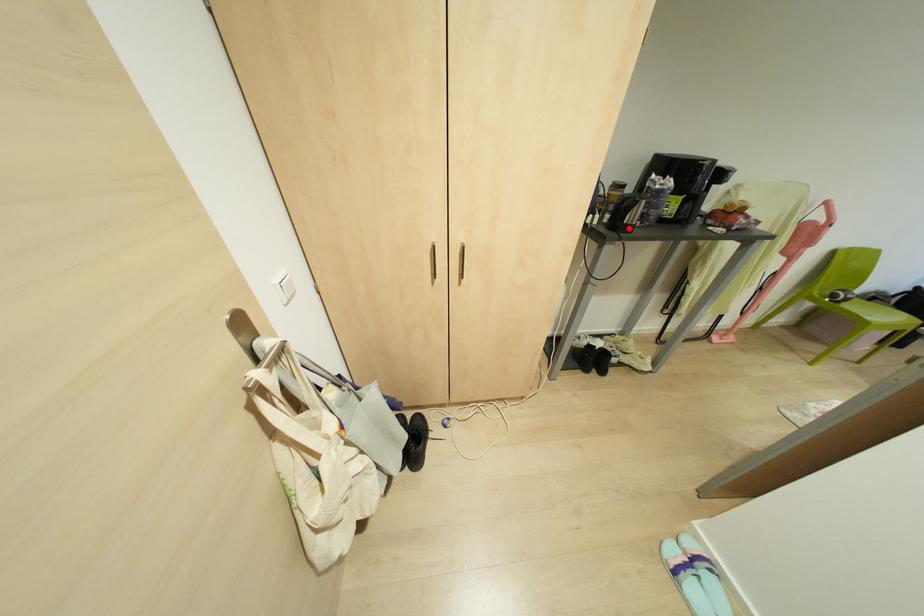
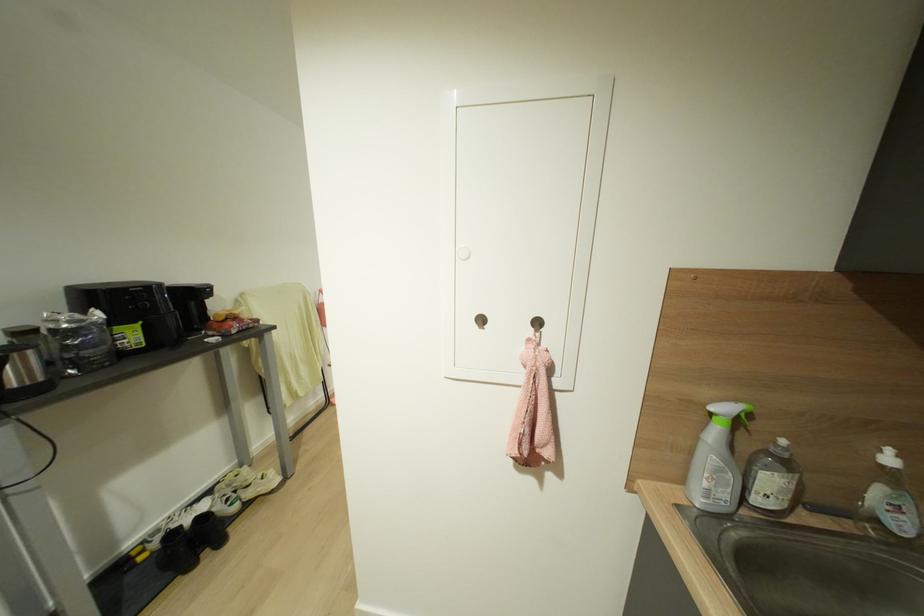
The point at the highlighted location is marked in the first image. Where is the corresponding point in the second image?

(39, 389)